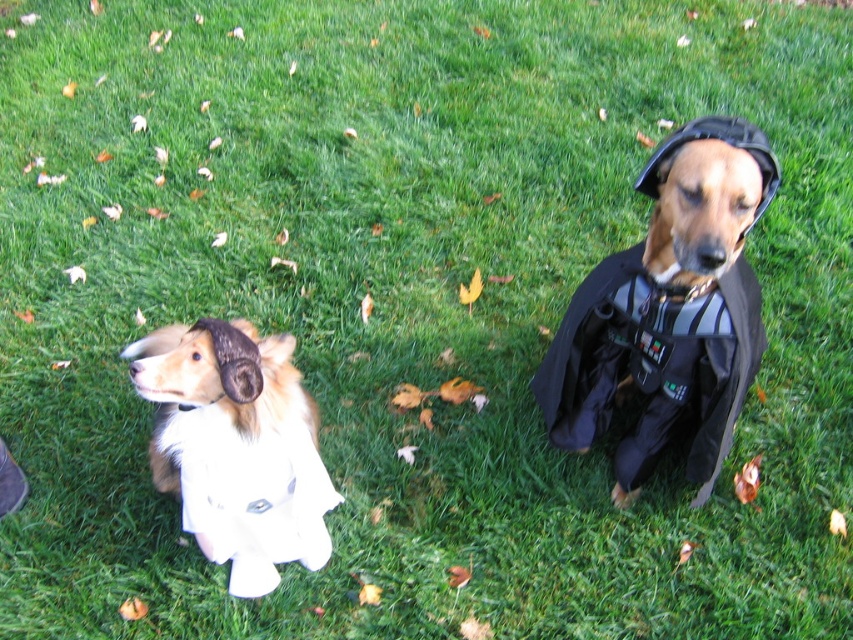
You are a photographer trying to capture a photo of both the shiny black cape at right and the white fluffy dog at left. Since you want both subjects to be in the frame, which direction should you move your camera to ensure both are visible?

You should move your camera to the left to ensure both the shiny black cape at right and the white fluffy dog at left are visible.

You are a photographer trying to capture a closeup of the shiny black cape at right. Based on its position, where should you aim your camera relative to the image frame?

The shiny black cape at right is located at point 0.486 on the horizontal axis and 0.785 on the vertical axis, so you should aim your camera slightly to the right and lower down within the image frame to capture it.